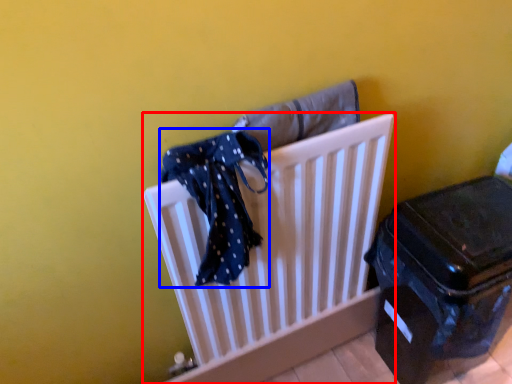
Question: Which object appears farthest to the camera in this image, furniture (highlighted by a red box) or scarf (highlighted by a blue box)?

Choices:
 (A) furniture
 (B) scarf

Answer: (A)